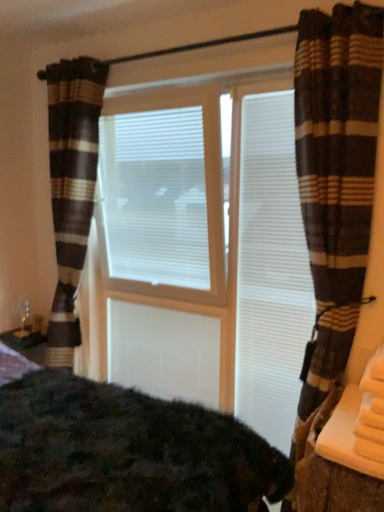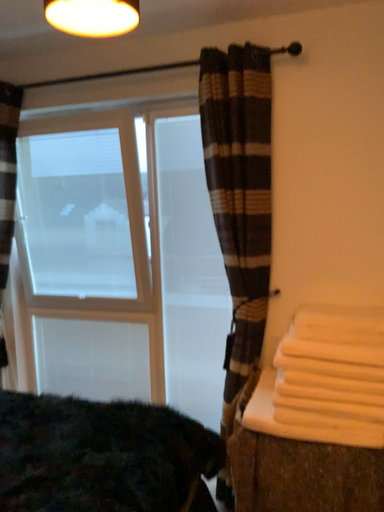
Question: Which way did the camera rotate in the video?

Choices:
 (A) rotated right
 (B) rotated left

Answer: (A)